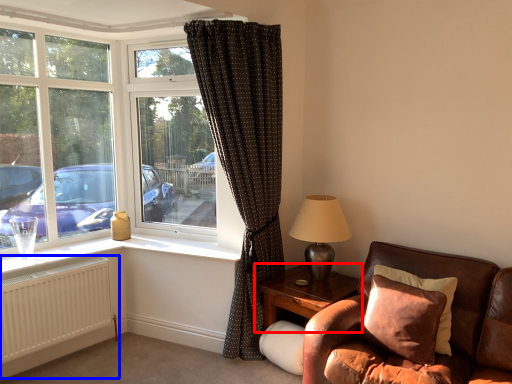
Question: Which object is closer to the camera taking this photo, table (highlighted by a red box) or radiator (highlighted by a blue box)?

Choices:
 (A) table
 (B) radiator

Answer: (B)